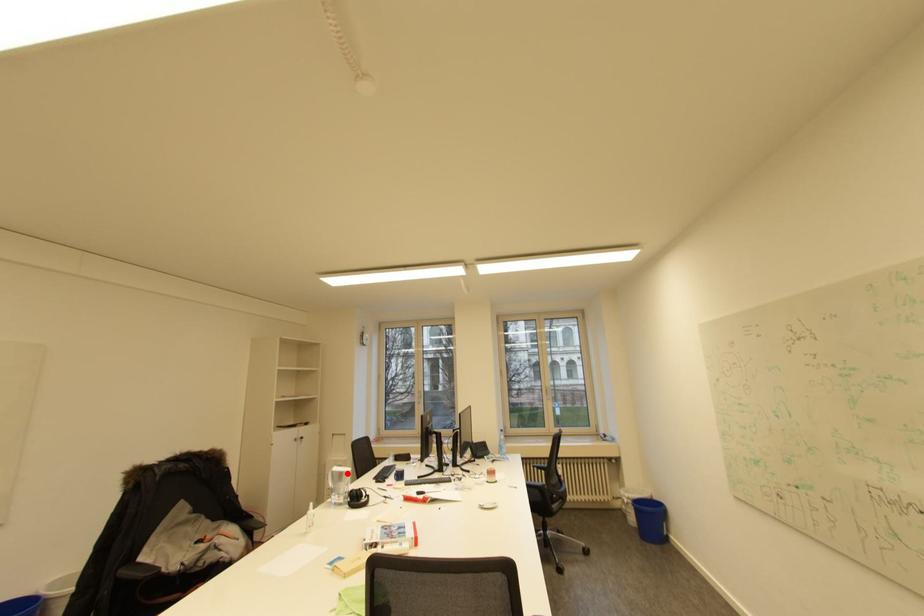
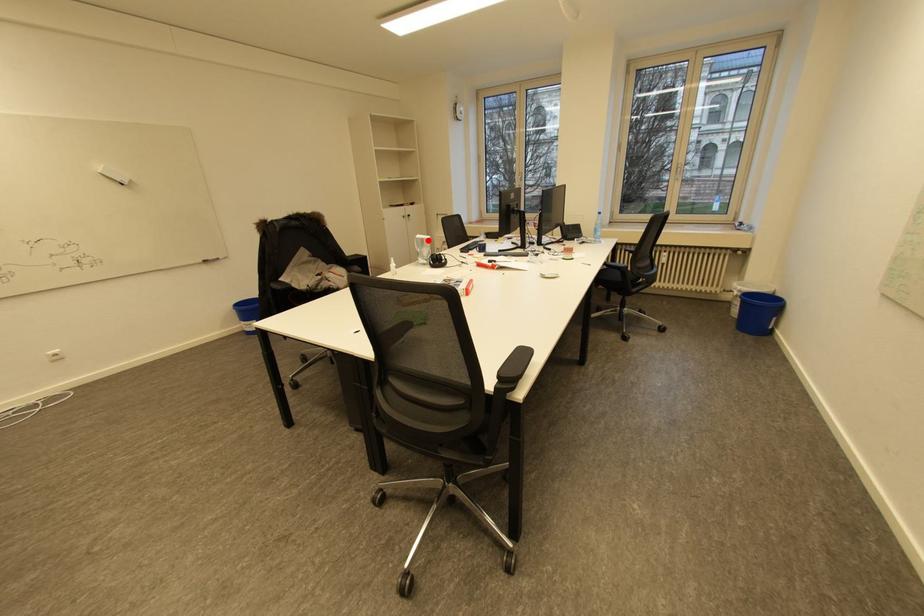
I am providing you with two images of the same scene from different viewpoints. A red point is marked on the first image and another point is marked on the second image. Are the points marked in image1 and image2 representing the same 3D position?

Yes